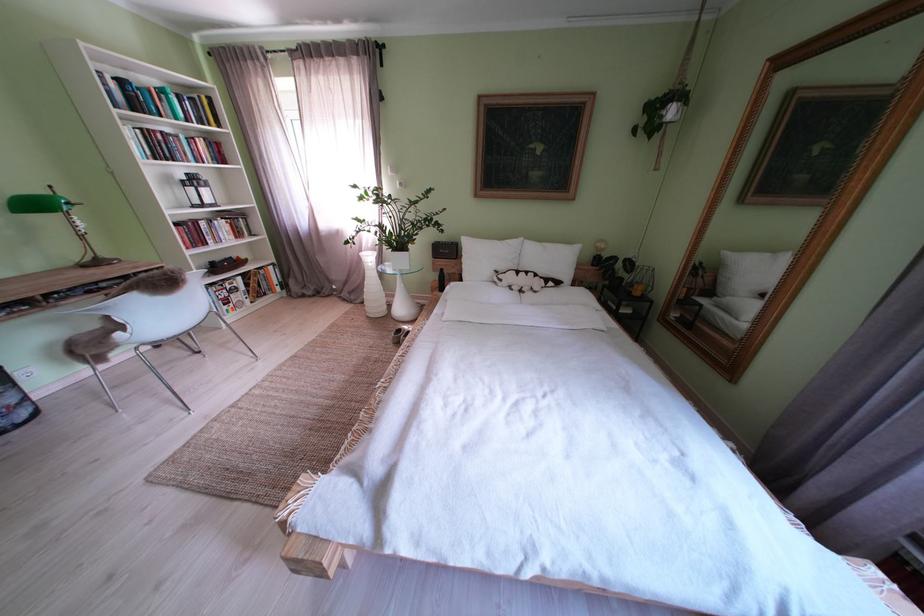
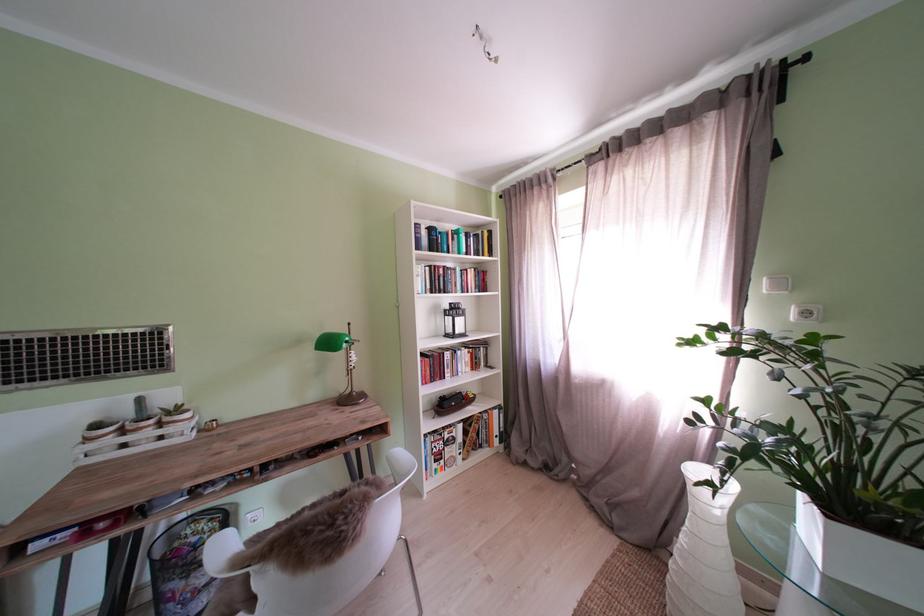
Where in the second image is the point corresponding to (x=235, y=286) from the first image?

(456, 434)